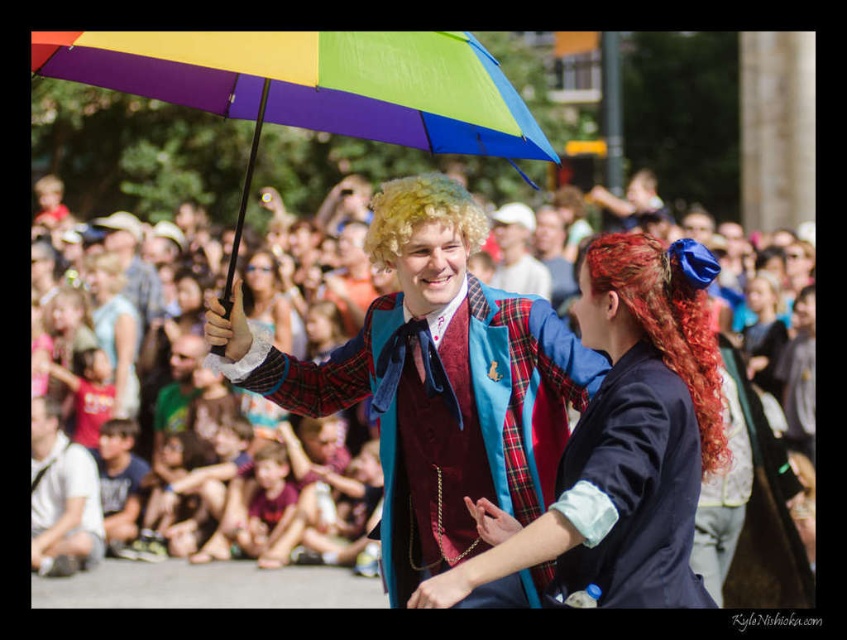
Between matte black shirt at lower left and plaid fabric jacket at center, which one is positioned lower?

matte black shirt at lower left is below.

Between matte black shirt at lower left and plaid fabric jacket at center, which one has less height?

With less height is plaid fabric jacket at center.

Image resolution: width=847 pixels, height=640 pixels. Describe the element at coordinates (119, 480) in the screenshot. I see `matte black shirt at lower left` at that location.

Where is `matte black shirt at lower left`? The width and height of the screenshot is (847, 640). matte black shirt at lower left is located at coordinates (119, 480).

Looking at this image, who is positioned more to the right, curly red hair at center or matte white shirt at lower left?

Positioned to the right is curly red hair at center.

Find the location of a particular element. This screenshot has height=640, width=847. curly red hair at center is located at coordinates (668, 316).

Locate an element on the screen. The height and width of the screenshot is (640, 847). curly red hair at center is located at coordinates (668, 316).

This screenshot has width=847, height=640. In order to click on curly red hair at center in this screenshot , I will do `click(668, 316)`.

Is curly red hair at center wider than matte black shirt at lower left?

Yes, curly red hair at center is wider than matte black shirt at lower left.

Does curly red hair at center have a lesser height compared to matte black shirt at lower left?

Incorrect, curly red hair at center's height does not fall short of matte black shirt at lower left's.

The height and width of the screenshot is (640, 847). Describe the element at coordinates (668, 316) in the screenshot. I see `curly red hair at center` at that location.

The height and width of the screenshot is (640, 847). In order to click on curly red hair at center in this screenshot , I will do `click(668, 316)`.